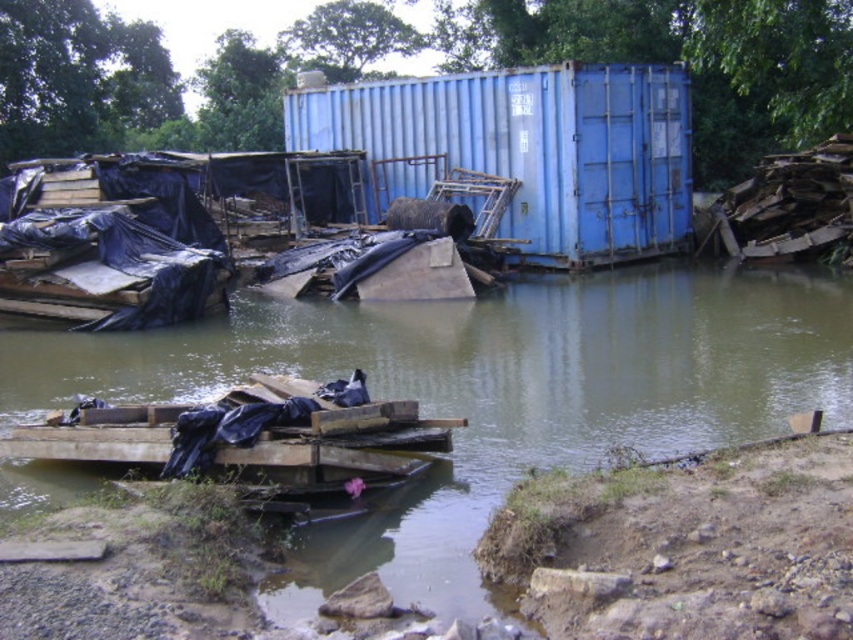
You are a rescue worker trying to navigate through the flooded area. You see the brown muddy water at center and the blue matte shipping container at center. Which one takes up more space in the scene?

The brown muddy water at center has a larger size compared to the blue matte shipping container at center, so it takes up more space in the scene.

You are a rescue worker trying to navigate through the flooded area. You need to move from the left side to the right side of the scene. The brown muddy water at center and the blue matte shipping container at center are in your path. Which one has a wider path to pass through?

The brown muddy water at center has a wider path than the blue matte shipping container at center because its width surpasses the container.